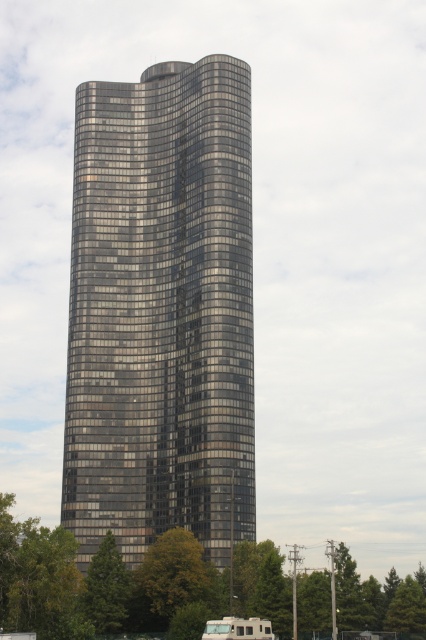
Question: Among these points, which one is nearest to the camera?

Choices:
 (A) (268, 634)
 (B) (250, 196)

Answer: (A)

Question: Can you confirm if glossy glass tower at center is positioned above white plastic boat at lower center?

Choices:
 (A) yes
 (B) no

Answer: (A)

Question: Among these points, which one is nearest to the camera?

Choices:
 (A) (166, 355)
 (B) (210, 632)

Answer: (B)

Question: Is glossy glass tower at center above white plastic boat at lower center?

Choices:
 (A) yes
 (B) no

Answer: (A)

Question: Can you confirm if glossy glass tower at center is smaller than white plastic boat at lower center?

Choices:
 (A) yes
 (B) no

Answer: (B)